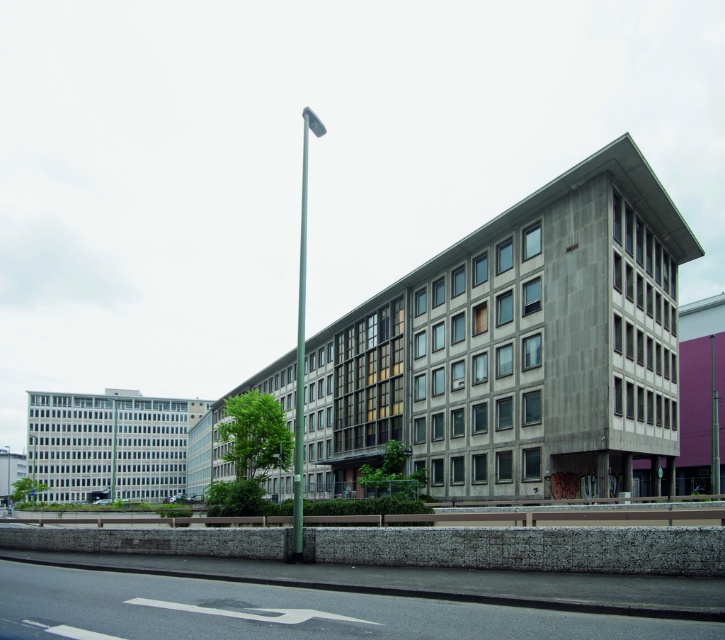
You are standing on the street in front of the building and see the green metallic pole at center and the silver metallic pole at center. Which pole is closer to the building?

The green metallic pole at center is to the right of the silver metallic pole at center, but their distance to the building isn

You are standing at the point labeled as point [302,344] in the image. What object is located exactly at that coordinate?

The point [302,344] indicates the location of the green metallic pole at center.